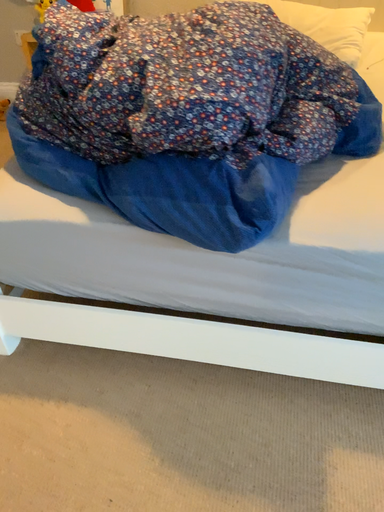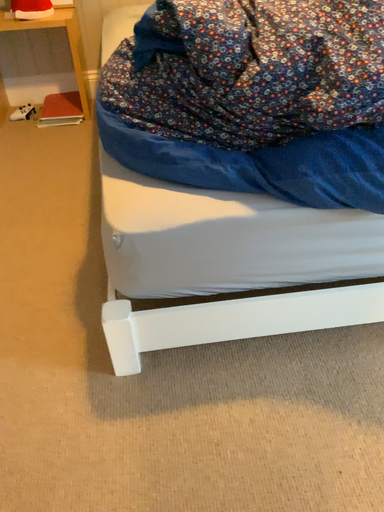
Question: Which way did the camera rotate in the video?

Choices:
 (A) rotated right
 (B) rotated left

Answer: (A)